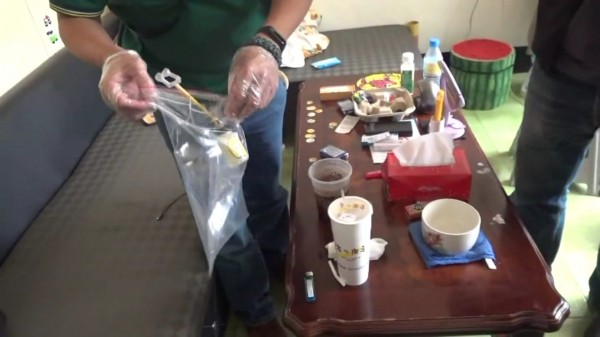
What are the coordinates of `tissue` in the screenshot? It's located at (x=425, y=154).